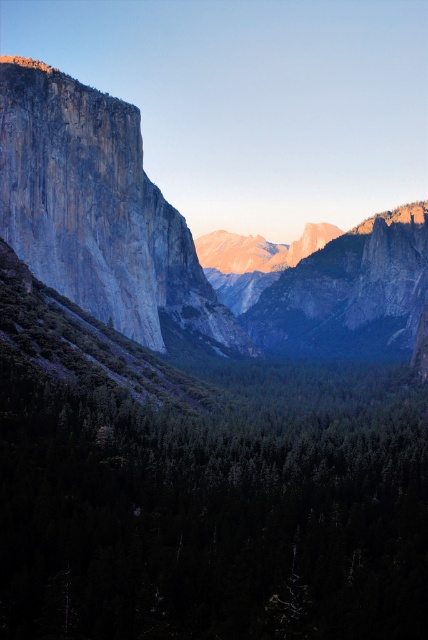
Question: Does green matte forest at center have a larger size compared to granite cliff face at left?

Choices:
 (A) yes
 (B) no

Answer: (B)

Question: Among these objects, which one is nearest to the camera?

Choices:
 (A) green matte forest at center
 (B) granite cliff face at left

Answer: (A)

Question: Does green matte forest at center have a greater width compared to granite cliff face at left?

Choices:
 (A) no
 (B) yes

Answer: (A)

Question: Does green matte forest at center appear under granite cliff face at left?

Choices:
 (A) no
 (B) yes

Answer: (B)

Question: Which point is farther from the camera taking this photo?

Choices:
 (A) (38, 458)
 (B) (162, 308)

Answer: (B)